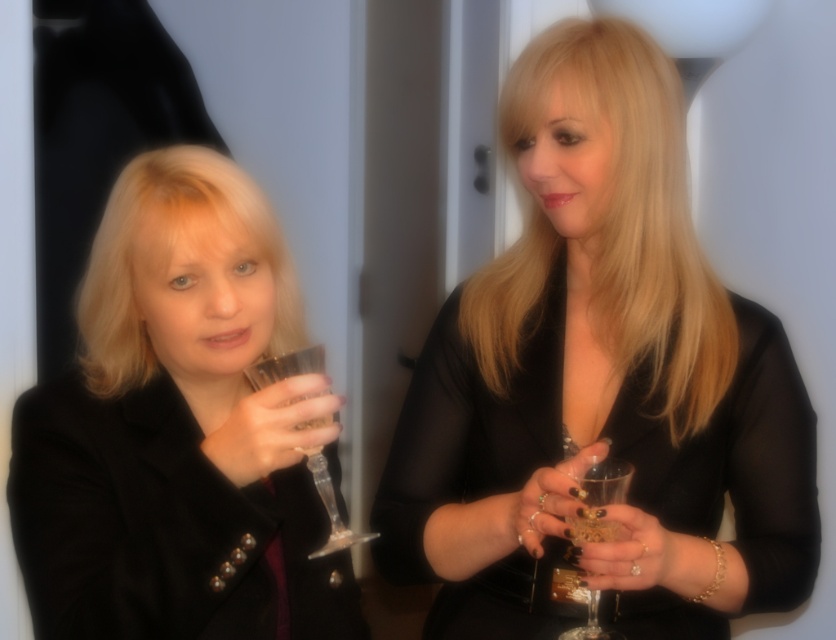
Question: Does black matte jacket at left appear over clear glass wine glass at center?

Choices:
 (A) no
 (B) yes

Answer: (B)

Question: Which of the following is the closest to the observer?

Choices:
 (A) clear glass wine glass at left
 (B) black matte jacket at left
 (C) clear glass wine glass at center
 (D) black glossy dress at center

Answer: (B)

Question: Is black glossy dress at center to the left of black matte jacket at left from the viewer's perspective?

Choices:
 (A) yes
 (B) no

Answer: (B)

Question: Does clear glass wine glass at left have a smaller size compared to clear glass wine glass at center?

Choices:
 (A) yes
 (B) no

Answer: (B)

Question: Among these points, which one is farthest from the camera?

Choices:
 (A) (544, 240)
 (B) (199, 584)
 (C) (279, 372)
 (D) (585, 628)

Answer: (A)

Question: Which point is closer to the camera?

Choices:
 (A) (209, 280)
 (B) (508, 97)
 (C) (597, 525)
 (D) (268, 369)

Answer: (D)